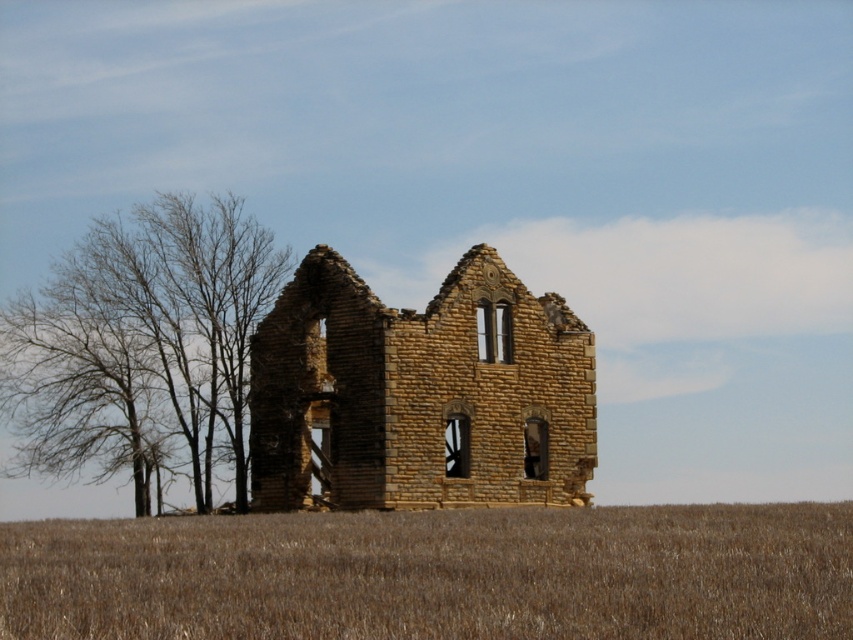
What do you see at coordinates (436, 573) in the screenshot? The width and height of the screenshot is (853, 640). I see `brown grassland at lower center` at bounding box center [436, 573].

Is point (782, 531) more distant than point (138, 308)?

That is False.

You are a GUI agent. You are given a task and a screenshot of the screen. Output one action in this format:
    pyautogui.click(x=<x>, y=<y>)
    Task: Click on the brown grassland at lower center
    
    Given the screenshot: What is the action you would take?
    pyautogui.click(x=436, y=573)

Between brown stone ruins at center and bare branches at left, which one appears on the right side from the viewer's perspective?

From the viewer's perspective, brown stone ruins at center appears more on the right side.

Can you confirm if brown stone ruins at center is smaller than bare branches at left?

Yes, brown stone ruins at center is smaller than bare branches at left.

Measure the distance between brown stone ruins at center and camera.

brown stone ruins at center is 97.47 meters away from camera.

Find the location of a particular element. The height and width of the screenshot is (640, 853). brown stone ruins at center is located at coordinates (421, 394).

Which of these two, brown grassland at lower center or brown stone ruins at center, stands taller?

brown stone ruins at center is taller.

Between point (331, 557) and point (486, 348), which one is positioned in front?

Positioned in front is point (331, 557).

Where is `brown grassland at lower center`? brown grassland at lower center is located at coordinates (436, 573).